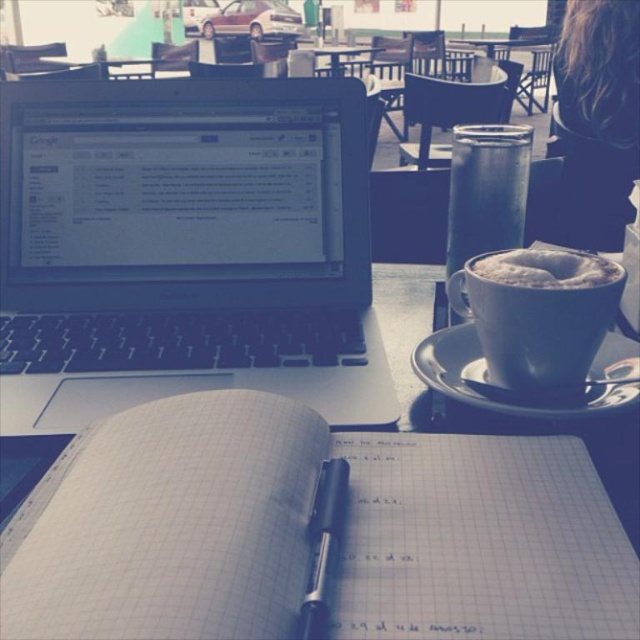
Question: Can you confirm if white frothy foam at right is positioned above wooden table at center?

Choices:
 (A) no
 (B) yes

Answer: (A)

Question: Which point is farther to the camera?

Choices:
 (A) (484, 214)
 (B) (76, 404)

Answer: (A)

Question: Can you confirm if white frothy foam at right is positioned to the right of wooden table at upper center?

Choices:
 (A) no
 (B) yes

Answer: (B)

Question: Does white grid paper notebook at center appear over black ceramic saucer at lower right?

Choices:
 (A) no
 (B) yes

Answer: (A)

Question: Which is nearer to the satin silver laptop at upper left?

Choices:
 (A) black plastic pen at center
 (B) metallic glass at upper right
 (C) wooden table at center

Answer: (B)

Question: Which point is closer to the camera?

Choices:
 (A) white grid paper notebook at center
 (B) satin silver laptop at upper left
 (C) black ceramic saucer at lower right
 (D) wooden table at upper center

Answer: (A)